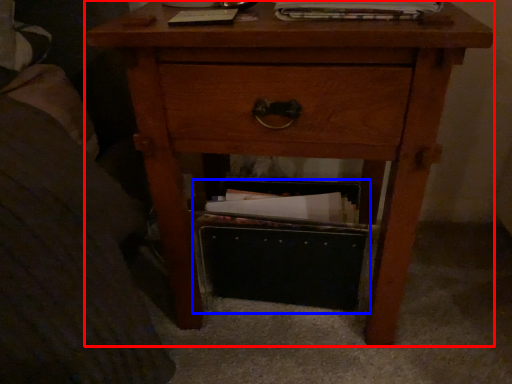
Question: Among these objects, which one is farthest to the camera, nightstand (highlighted by a red box) or shoe box (highlighted by a blue box)?

Choices:
 (A) nightstand
 (B) shoe box

Answer: (B)